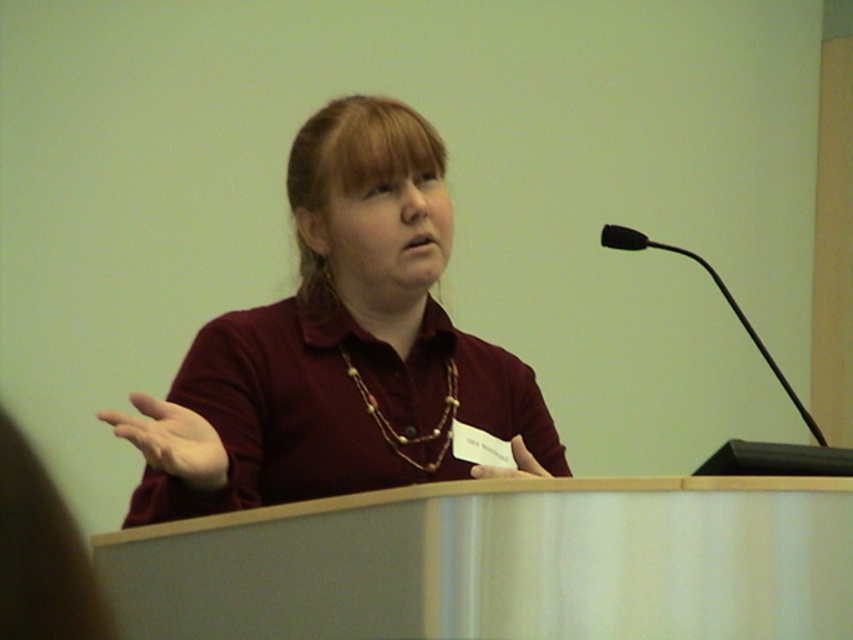
Can you confirm if maroon fabric shirt at center is positioned to the left of brown beaded necklace at center?

No, maroon fabric shirt at center is not to the left of brown beaded necklace at center.

Between maroon fabric shirt at center and brown beaded necklace at center, which one appears on the left side from the viewer's perspective?

From the viewer's perspective, brown beaded necklace at center appears more on the left side.

I want to click on maroon fabric shirt at center, so click(x=339, y=346).